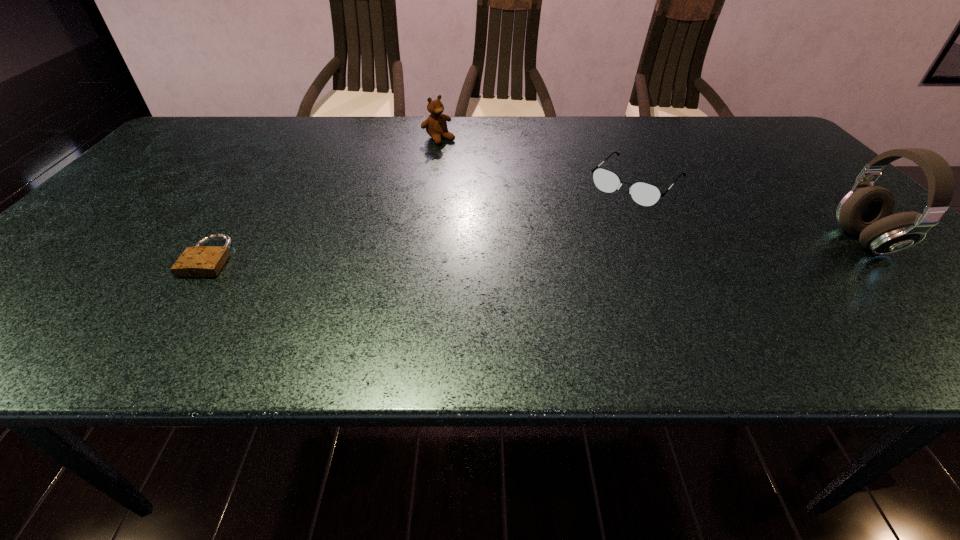
Locate an element on the screen. The image size is (960, 540). padlock is located at coordinates (200, 261).

You are a GUI agent. You are given a task and a screenshot of the screen. Output one action in this format:
    pyautogui.click(x=<x>, y=<y>)
    Task: Click on the shortest object
    
    Given the screenshot: What is the action you would take?
    pyautogui.click(x=200, y=261)

You are a GUI agent. You are given a task and a screenshot of the screen. Output one action in this format:
    pyautogui.click(x=<x>, y=<y>)
    Task: Click on the headset
    The image size is (960, 540).
    Given the screenshot: What is the action you would take?
    pyautogui.click(x=866, y=211)

The image size is (960, 540). In order to click on the tallest object in this screenshot , I will do `click(866, 211)`.

At what (x,y) coordinates should I click in order to perform the action: click on the third tallest object. Please return your answer as a coordinate pair (x, y). The width and height of the screenshot is (960, 540). Looking at the image, I should click on (645, 194).

What are the coordinates of `spectacles` in the screenshot? It's located at (645, 194).

This screenshot has width=960, height=540. In order to click on the third object from right to left in this screenshot , I will do `click(436, 126)`.

Identify the location of the farthest object. The height and width of the screenshot is (540, 960). (436, 126).

At what (x,y) coordinates should I click in order to perform the action: click on free space located 0.320m on the lenses of the second shortest object. Please return your answer as a coordinate pair (x, y). The height and width of the screenshot is (540, 960). Looking at the image, I should click on (548, 275).

Where is `vacant space situated on the lenses of the second shortest object`? Image resolution: width=960 pixels, height=540 pixels. vacant space situated on the lenses of the second shortest object is located at coordinates (589, 233).